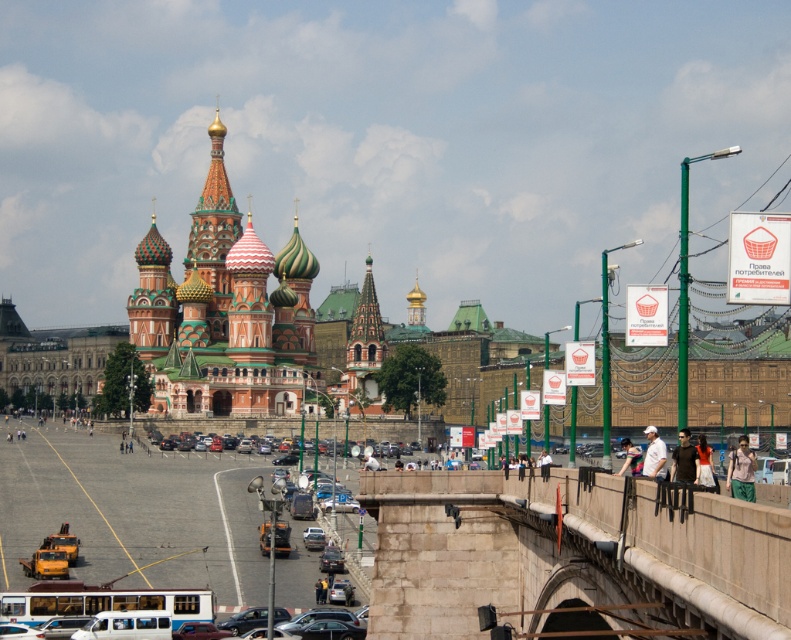
Looking at this image, you are standing in the plaza in front of the cathedral and want to cross the road to reach the brown leather jacket at lower right. Is the stone bridge at center between you and the jacket?

The stone bridge at center is closer to the viewer than the brown leather jacket at lower right, so yes, the stone bridge at center is between you and the brown leather jacket at lower right.

You are a tourist in the plaza and want to take a photo of the pink fabric shirt at upper right and the light blue denim jeans at lower right. Which object should you focus on first if you want to capture both in a single frame without moving the camera?

You should focus on the pink fabric shirt at upper right first because it is larger in size than the light blue denim jeans at lower right, so it will occupy more space in the frame.